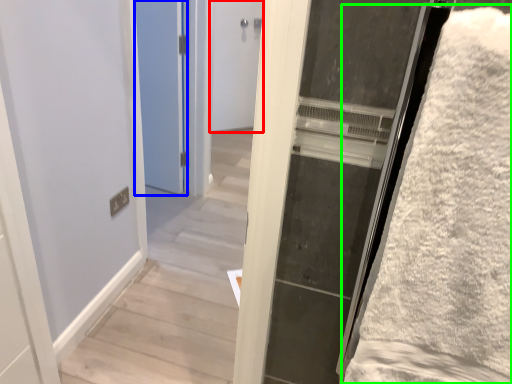
Question: Which object is positioned closest to door (highlighted by a red box)? Select from door (highlighted by a blue box) and bath towel (highlighted by a green box).

Choices:
 (A) door
 (B) bath towel

Answer: (A)